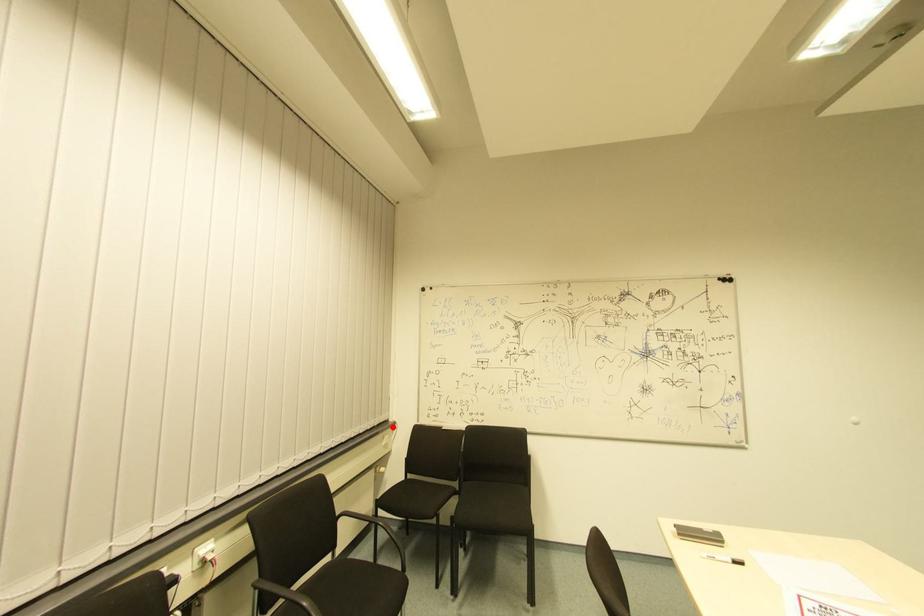
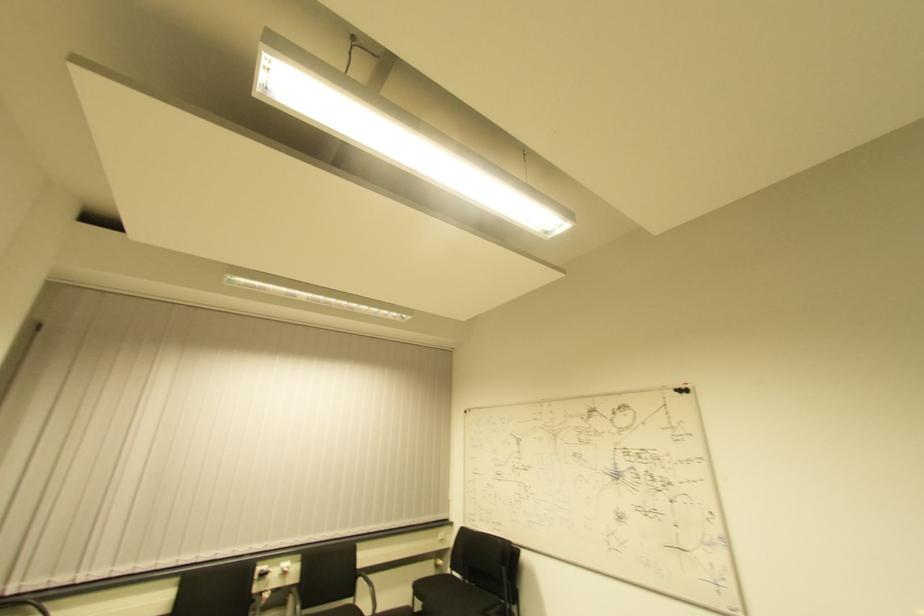
Find the pixel in the second image that matches the highlighted location in the first image.

(450, 527)